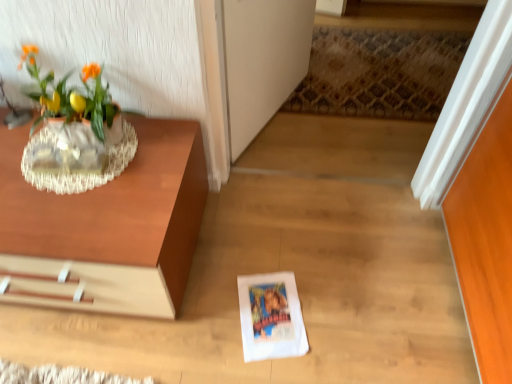
Question: From a real-world perspective, relative to matte glass vase at upper left, is white paper at center vertically above or below?

Choices:
 (A) below
 (B) above

Answer: (A)

Question: Visually, is white paper at center positioned to the left or to the right of matte glass vase at upper left?

Choices:
 (A) left
 (B) right

Answer: (B)

Question: Which object is positioned closest to the clear glass vase at upper left?

Choices:
 (A) matte glass vase at upper left
 (B) transparent glass door at center
 (C) wooden table at left
 (D) white paper at center

Answer: (A)

Question: Which is farther from the white paper at center?

Choices:
 (A) clear glass vase at upper left
 (B) transparent glass door at center
 (C) wooden table at left
 (D) matte glass vase at upper left

Answer: (B)